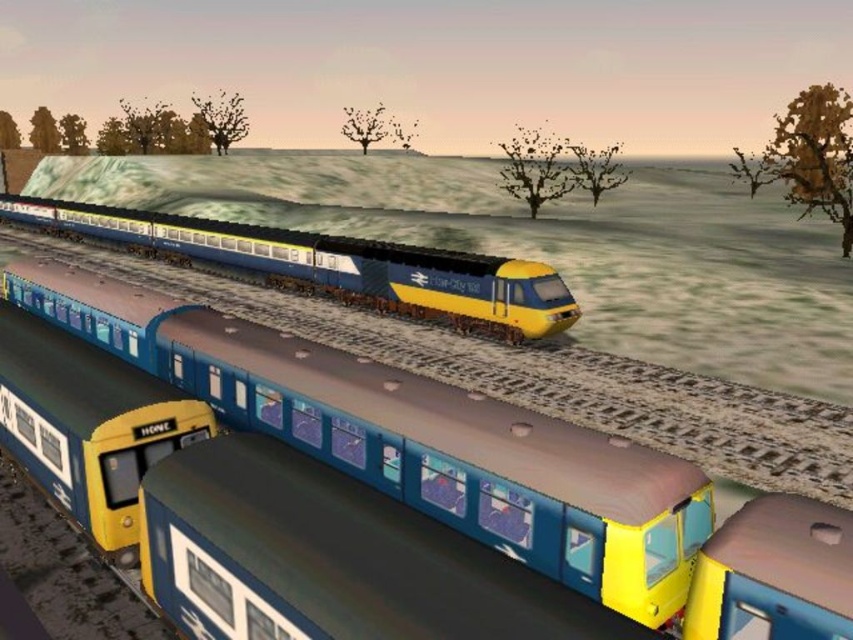
You are standing at the edge of the tracks and see both the metallic blue train at center and the blue glossy train at center. Which train is closer to you?

The metallic blue train at center is closer to you since it is in front of the blue glossy train at center.

You are a passenger on the metallic blue train at center and want to walk to the blue glossy train at center. Can you walk directly between them? Explain why or why not based on their distance.

The metallic blue train at center and the blue glossy train at center are 11.04 meters apart. Since the distance between them is quite large, you cannot walk directly between them as the gap is too wide for safe passage.

You are standing at the origin point in the scene. Which direction should you move to reach the metallic blue train at center?

The metallic blue train at center is located at point (474, 461), so you should move towards the right and forward to reach it.